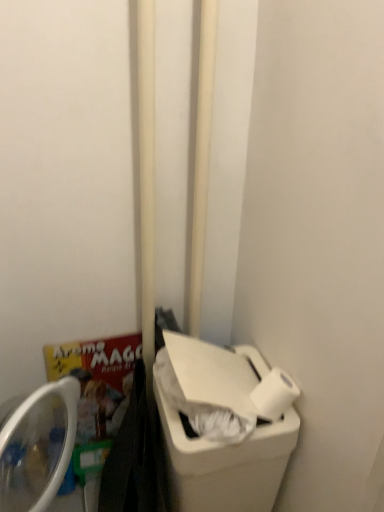
Question: Is white plastic recycling bin at lower right looking in the opposite direction of white smooth pole at center, placed as the first pole when sorted from right to left?

Choices:
 (A) no
 (B) yes

Answer: (A)

Question: Would you consider white plastic recycling bin at lower right to be distant from white smooth pole at center, marked as the second pole in a left-to-right arrangement?

Choices:
 (A) no
 (B) yes

Answer: (A)

Question: From a real-world perspective, is white plastic recycling bin at lower right positioned under white smooth pole at center, placed as the first pole when sorted from right to left, based on gravity?

Choices:
 (A) yes
 (B) no

Answer: (A)

Question: Is white plastic recycling bin at lower right to the right of white smooth pole at center, marked as the second pole in a left-to-right arrangement, from the viewer's perspective?

Choices:
 (A) no
 (B) yes

Answer: (B)

Question: Would you say white smooth pole at center, placed as the first pole when sorted from right to left, is part of white plastic recycling bin at lower right's contents?

Choices:
 (A) yes
 (B) no

Answer: (B)

Question: Considering the relative sizes of white plastic recycling bin at lower right and white smooth pole at center, marked as the second pole in a left-to-right arrangement, in the image provided, is white plastic recycling bin at lower right shorter than white smooth pole at center, marked as the second pole in a left-to-right arrangement,?

Choices:
 (A) yes
 (B) no

Answer: (A)

Question: Is white matte toilet paper at lower right facing away from white smooth pole at center, the first pole in the left-to-right sequence?

Choices:
 (A) no
 (B) yes

Answer: (A)

Question: From the image's perspective, does white matte toilet paper at lower right appear higher than white smooth pole at center, positioned as the second pole in right-to-left order?

Choices:
 (A) no
 (B) yes

Answer: (A)

Question: From a real-world perspective, is white matte toilet paper at lower right positioned under white smooth pole at center, positioned as the second pole in right-to-left order, based on gravity?

Choices:
 (A) no
 (B) yes

Answer: (B)

Question: Is white matte toilet paper at lower right smaller than white smooth pole at center, positioned as the second pole in right-to-left order?

Choices:
 (A) yes
 (B) no

Answer: (A)

Question: Considering the relative sizes of white matte toilet paper at lower right and white smooth pole at center, positioned as the second pole in right-to-left order, in the image provided, is white matte toilet paper at lower right taller than white smooth pole at center, positioned as the second pole in right-to-left order,?

Choices:
 (A) no
 (B) yes

Answer: (A)

Question: Is white matte toilet paper at lower right positioned behind white smooth pole at center, the first pole in the left-to-right sequence?

Choices:
 (A) yes
 (B) no

Answer: (A)

Question: From a real-world perspective, is white smooth pole at center, the first pole in the left-to-right sequence, over white matte toilet paper at lower right?

Choices:
 (A) no
 (B) yes

Answer: (B)